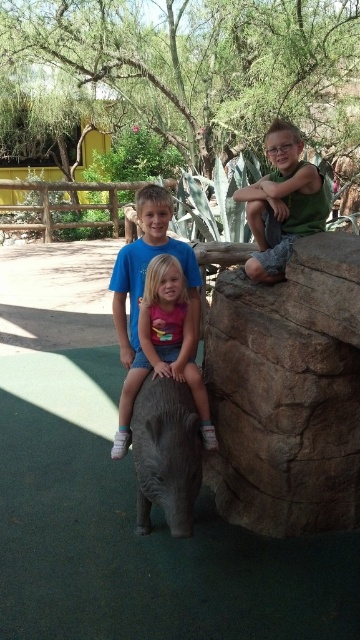
Is the position of brown rough rock at right less distant than that of green matte shirt at upper right?

Yes, brown rough rock at right is closer to the viewer.

Who is positioned more to the right, brown rough rock at right or green matte shirt at upper right?

brown rough rock at right is more to the right.

Who is more forward, (x=277, y=376) or (x=299, y=195)?

Positioned in front is point (x=277, y=376).

Identify the location of brown rough rock at right. Image resolution: width=360 pixels, height=640 pixels. (288, 392).

Does brown rough rock at right have a greater width compared to gray matte elephant at center?

Yes, brown rough rock at right is wider than gray matte elephant at center.

Is point (299, 451) more distant than point (185, 499)?

Yes, it is.

The image size is (360, 640). Describe the element at coordinates (288, 392) in the screenshot. I see `brown rough rock at right` at that location.

This screenshot has height=640, width=360. What are the coordinates of `brown rough rock at right` in the screenshot? It's located at (288, 392).

Is point (267, 266) less distant than point (141, 314)?

No, (267, 266) is further to viewer.

Which is in front, point (285, 250) or point (127, 433)?

Positioned in front is point (127, 433).

You are a GUI agent. You are given a task and a screenshot of the screen. Output one action in this format:
    pyautogui.click(x=<x>, y=<y>)
    Task: Click on the green matte shirt at upper right
    This screenshot has width=360, height=640.
    Given the screenshot: What is the action you would take?
    pyautogui.click(x=281, y=204)